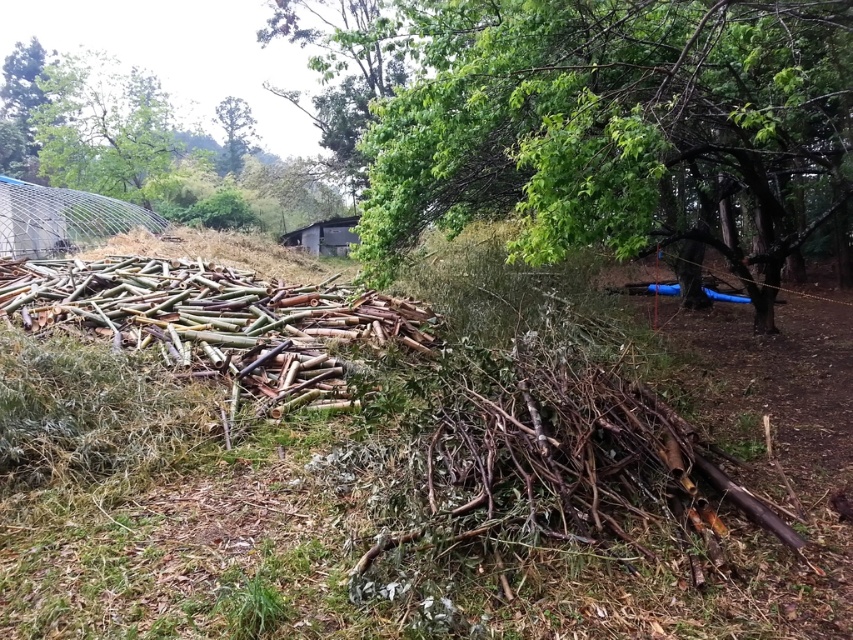
Question: Which point is closer to the camera taking this photo?

Choices:
 (A) (238, 134)
 (B) (41, 109)
 (C) (747, 154)

Answer: (C)

Question: Can you confirm if green leafy tree at center is smaller than green leafy tree at upper left?

Choices:
 (A) no
 (B) yes

Answer: (B)

Question: Which point is farther from the camera taking this photo?

Choices:
 (A) (753, 67)
 (B) (138, 109)

Answer: (B)

Question: Can you confirm if green leafy tree at upper left is thinner than green leafy tree at upper center?

Choices:
 (A) yes
 (B) no

Answer: (B)

Question: Which of these objects is positioned closest to the green leafy tree at upper center?

Choices:
 (A) green leafy tree at upper left
 (B) green leafy tree at center

Answer: (A)

Question: Does green leafy tree at center have a lesser width compared to green leafy tree at upper center?

Choices:
 (A) no
 (B) yes

Answer: (B)